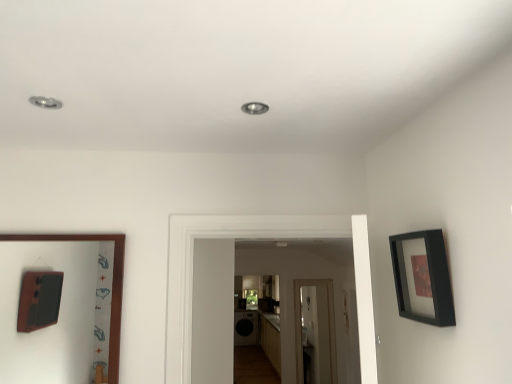
Question: Looking at the image, does wooden picture frame at left, the second picture frame positioned from the front, seem bigger or smaller compared to black matte picture frame at upper right, which is the 2th picture frame in back-to-front order?

Choices:
 (A) small
 (B) big

Answer: (B)

Question: Is wooden picture frame at left, which is the first picture frame in left-to-right order, inside the boundaries of black matte picture frame at upper right, arranged as the 1th picture frame when viewed from the front, or outside?

Choices:
 (A) inside
 (B) outside

Answer: (B)

Question: From the image's perspective, is wooden picture frame at left, which is counted as the 2th picture frame, starting from the right, located above or below black matte picture frame at upper right, which appears as the second picture frame when viewed from the left?

Choices:
 (A) above
 (B) below

Answer: (B)

Question: Considering the positions of black matte picture frame at upper right, which is the first picture frame from right to left, and wooden picture frame at left, which is the 1th picture frame from back to front, in the image, is black matte picture frame at upper right, which is the first picture frame from right to left, taller or shorter than wooden picture frame at left, which is the 1th picture frame from back to front,?

Choices:
 (A) tall
 (B) short

Answer: (B)

Question: From the image's perspective, is black matte picture frame at upper right, which is the 2th picture frame in back-to-front order, located above or below wooden picture frame at left, which is counted as the 2th picture frame, starting from the right?

Choices:
 (A) below
 (B) above

Answer: (B)

Question: From a real-world perspective, is black matte picture frame at upper right, which appears as the second picture frame when viewed from the left, positioned above or below wooden picture frame at left, which is the 1th picture frame from back to front?

Choices:
 (A) below
 (B) above

Answer: (B)

Question: Looking at the image, does black matte picture frame at upper right, which is the 2th picture frame in back-to-front order, seem bigger or smaller compared to wooden picture frame at left, which is the 1th picture frame from back to front?

Choices:
 (A) small
 (B) big

Answer: (A)